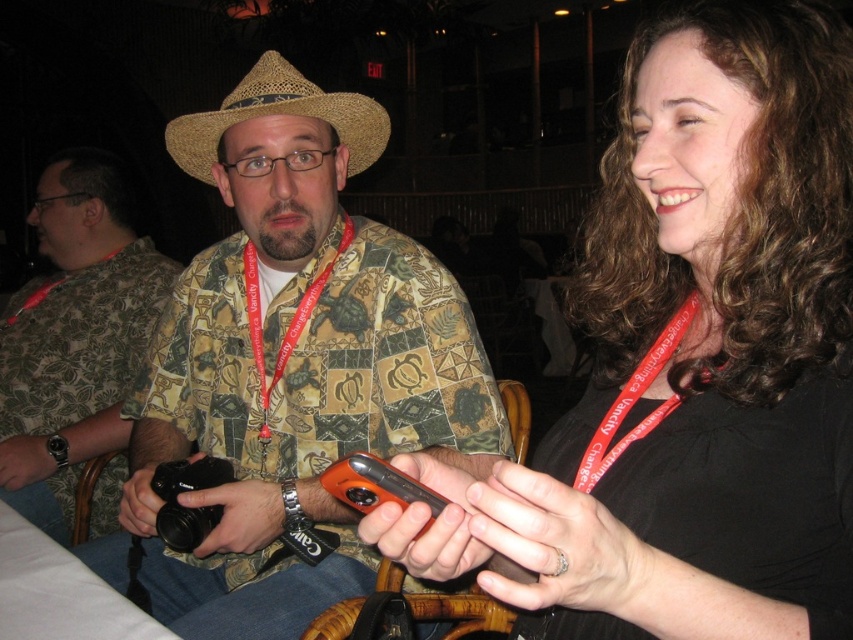
Between point (454, 433) and point (134, 310), which one is positioned behind?

Positioned behind is point (134, 310).

Which of these two, matte black camera at center or brushed metal camera at left, stands taller?

With more height is brushed metal camera at left.

Find the location of a particular element. The height and width of the screenshot is (640, 853). matte black camera at center is located at coordinates (291, 365).

Is point (654, 97) more distant than point (111, 340)?

No.

Describe the element at coordinates (694, 358) in the screenshot. The image size is (853, 640). I see `matte black phone at center` at that location.

Between point (646, 582) and point (56, 248), which one is positioned behind?

Positioned behind is point (56, 248).

Locate an element on the screen. The image size is (853, 640). matte black phone at center is located at coordinates (694, 358).

The image size is (853, 640). What do you see at coordinates (74, 337) in the screenshot? I see `brushed metal camera at left` at bounding box center [74, 337].

Which is behind, point (12, 488) or point (376, 100)?

The point (376, 100) is behind.

Is point (97, 204) positioned behind point (289, 76)?

Yes, it is.

Find the location of a particular element. Image resolution: width=853 pixels, height=640 pixels. brushed metal camera at left is located at coordinates (74, 337).